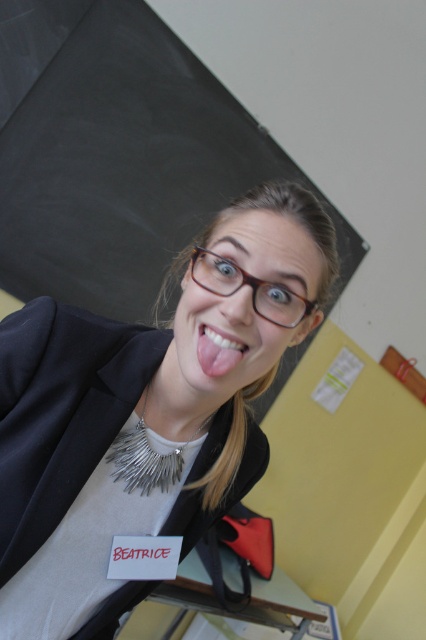
Consider the image. You are a student in the classroom and want to pin a note on the yellow matte bulletin board at upper center. However, you notice the brown matte glasses at center are blocking your view. Are the glasses in the way of the bulletin board?

The yellow matte bulletin board at upper center is to the left of the brown matte glasses at center, so the glasses are blocking the view to the bulletin board.

You are a fashion designer observing a model wearing the matte black blazer at center and brown matte glasses at center. Which item is located more to the left?

The matte black blazer at center is positioned on the left side of brown matte glasses at center, so the matte black blazer at center is more to the left.

From the picture: You are a photographer trying to capture a closeup shot of the person in the classroom. Since the brown matte glasses at center and glossy white teeth at center are both at the center, which object would appear closer to the camera lens?

The brown matte glasses at center is much taller than the glossy white teeth at center, so the glasses would appear closer to the camera lens.